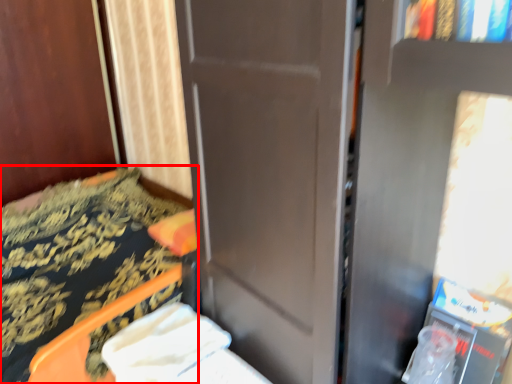
Question: From the image, what is the correct spatial relationship of furniture (annotated by the red box) in relation to sheet?

Choices:
 (A) left
 (B) right

Answer: (A)